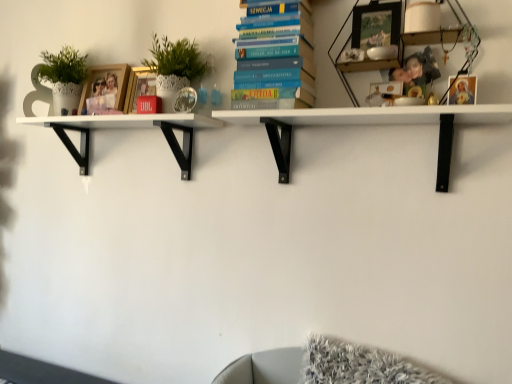
Question: From the image's perspective, is wooden photo frame at upper left, which is counted as the first picture frame, starting from the left, above wooden photo frame at upper right, which is counted as the 3th shelf, starting from the left?

Choices:
 (A) no
 (B) yes

Answer: (A)

Question: Does wooden photo frame at upper left, which ranks as the fourth picture frame in right-to-left order, have a greater height compared to wooden photo frame at upper right, which is counted as the 3th shelf, starting from the left?

Choices:
 (A) no
 (B) yes

Answer: (A)

Question: Would you say wooden photo frame at upper left, arranged as the 1th picture frame when viewed from the back, is outside wooden photo frame at upper right, positioned as the first shelf in right-to-left order?

Choices:
 (A) no
 (B) yes

Answer: (B)

Question: Is wooden photo frame at upper right, which is counted as the 3th shelf, starting from the left, at the back of wooden photo frame at upper left, arranged as the 1th picture frame when viewed from the back?

Choices:
 (A) no
 (B) yes

Answer: (A)

Question: From a real-world perspective, is wooden photo frame at upper left, which is counted as the first picture frame, starting from the left, located higher than wooden photo frame at upper right, positioned as the first shelf in right-to-left order?

Choices:
 (A) yes
 (B) no

Answer: (B)

Question: From a real-world perspective, is matte gold picture frame at upper right, which is the 4th picture frame in back-to-front order, positioned above or below blue hardcover book at center?

Choices:
 (A) above
 (B) below

Answer: (B)

Question: Choose the correct answer: Is matte gold picture frame at upper right, the 1th picture frame positioned from the front, inside blue hardcover book at center or outside it?

Choices:
 (A) outside
 (B) inside

Answer: (A)

Question: Considering their positions, is matte gold picture frame at upper right, the 4th picture frame in the left-to-right sequence, located in front of or behind blue hardcover book at center?

Choices:
 (A) behind
 (B) front

Answer: (B)

Question: From the image's perspective, is matte gold picture frame at upper right, the 1th picture frame positioned from the front, above or below blue hardcover book at center?

Choices:
 (A) below
 (B) above

Answer: (A)

Question: In terms of size, does blue hardcover book at center appear bigger or smaller than white matte shelf at left, arranged as the third shelf when viewed from the right?

Choices:
 (A) big
 (B) small

Answer: (B)

Question: Would you say blue hardcover book at center is to the left or to the right of white matte shelf at left, which ranks as the first shelf in left-to-right order, in the picture?

Choices:
 (A) right
 (B) left

Answer: (A)

Question: Does point (306, 105) appear closer or farther from the camera than point (141, 127)?

Choices:
 (A) closer
 (B) farther

Answer: (A)

Question: From the image's perspective, is blue hardcover book at center positioned above or below white matte shelf at left, which ranks as the first shelf in left-to-right order?

Choices:
 (A) above
 (B) below

Answer: (A)

Question: Is wooden photo frame at upper right, which is counted as the 3th shelf, starting from the left, inside or outside of gold metallic picture frame at upper center, which is counted as the second picture frame, starting from the back?

Choices:
 (A) outside
 (B) inside

Answer: (A)

Question: Based on their positions, is wooden photo frame at upper right, positioned as the first shelf in right-to-left order, located to the left or right of gold metallic picture frame at upper center, which ranks as the 2th picture frame in left-to-right order?

Choices:
 (A) left
 (B) right

Answer: (B)